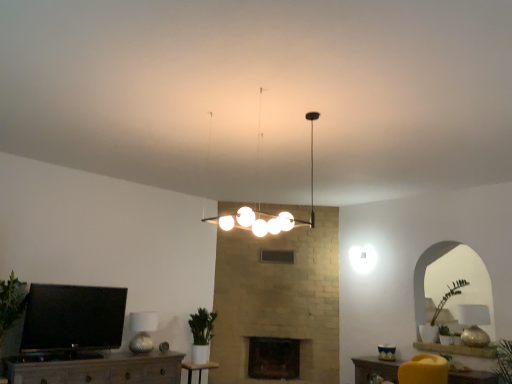
Question: From the image's perspective, is wooden table at center, the first table from the left, located above dark stone fireplace at center?

Choices:
 (A) no
 (B) yes

Answer: (B)

Question: Is wooden table at center, marked as the 2th table in a right-to-left arrangement, located outside dark stone fireplace at center?

Choices:
 (A) no
 (B) yes

Answer: (B)

Question: Is the position of wooden table at center, which appears as the 1th table when viewed from the back, more distant than that of dark stone fireplace at center?

Choices:
 (A) yes
 (B) no

Answer: (B)

Question: Can you confirm if wooden table at center, the first table from the left, is bigger than dark stone fireplace at center?

Choices:
 (A) yes
 (B) no

Answer: (B)

Question: Is wooden table at center, which is the 2th table from front to back, facing away from dark stone fireplace at center?

Choices:
 (A) no
 (B) yes

Answer: (A)

Question: Can dark stone fireplace at center be found inside wooden table at center, which is the second table in top-to-bottom order?

Choices:
 (A) no
 (B) yes

Answer: (A)

Question: Considering the relative sizes of dark stone fireplace at center and metallic textured lampshade at lower left, which is the 1th lamp in bottom-to-top order, in the image provided, is dark stone fireplace at center taller than metallic textured lampshade at lower left, which is the 1th lamp in bottom-to-top order,?

Choices:
 (A) yes
 (B) no

Answer: (A)

Question: From a real-world perspective, is dark stone fireplace at center over metallic textured lampshade at lower left, arranged as the third lamp when viewed from the front?

Choices:
 (A) yes
 (B) no

Answer: (B)

Question: From the image's perspective, is dark stone fireplace at center beneath metallic textured lampshade at lower left, which is the 1th lamp in bottom-to-top order?

Choices:
 (A) yes
 (B) no

Answer: (A)

Question: Could metallic textured lampshade at lower left, arranged as the third lamp when viewed from the front, be considered to be inside dark stone fireplace at center?

Choices:
 (A) no
 (B) yes

Answer: (A)

Question: Is dark stone fireplace at center bigger than metallic textured lampshade at lower left, arranged as the third lamp when viewed from the front?

Choices:
 (A) yes
 (B) no

Answer: (A)

Question: Can you confirm if dark stone fireplace at center is shorter than metallic textured lampshade at lower left, arranged as the third lamp when viewed from the front?

Choices:
 (A) no
 (B) yes

Answer: (A)

Question: Is green matte plant at center facing away from white glossy light fixture at center, the third lamp in the back-to-front sequence?

Choices:
 (A) no
 (B) yes

Answer: (A)